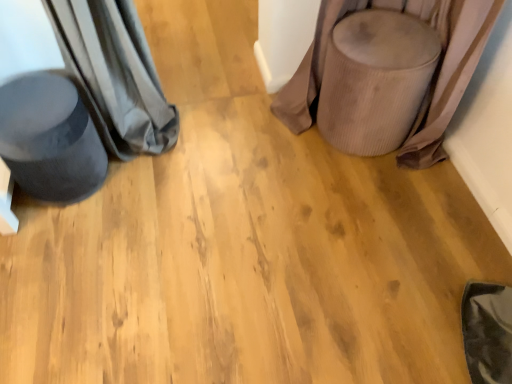
Image resolution: width=512 pixels, height=384 pixels. What are the coordinates of `free spot above velvet dark grey swivel chair at left, which is the second swivel chair in right-to-left order (from a real-world perspective)` in the screenshot? It's located at (33, 96).